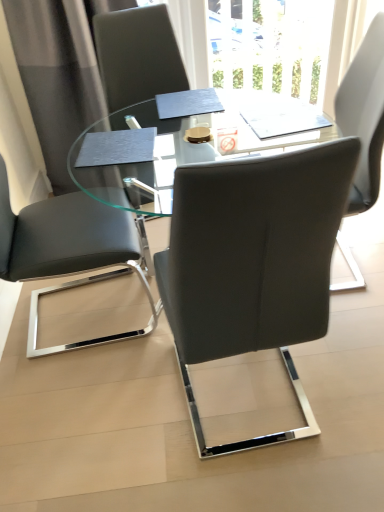
Find the location of a particular element. The width and height of the screenshot is (384, 512). vacant area that lies in front of matte black chair at left, acting as the 2th chair starting from the right is located at coordinates (79, 407).